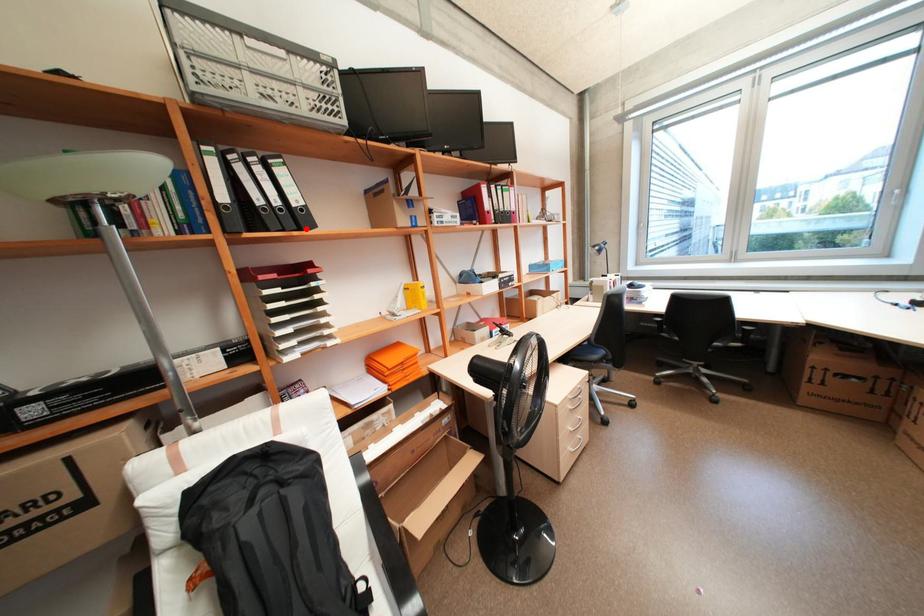
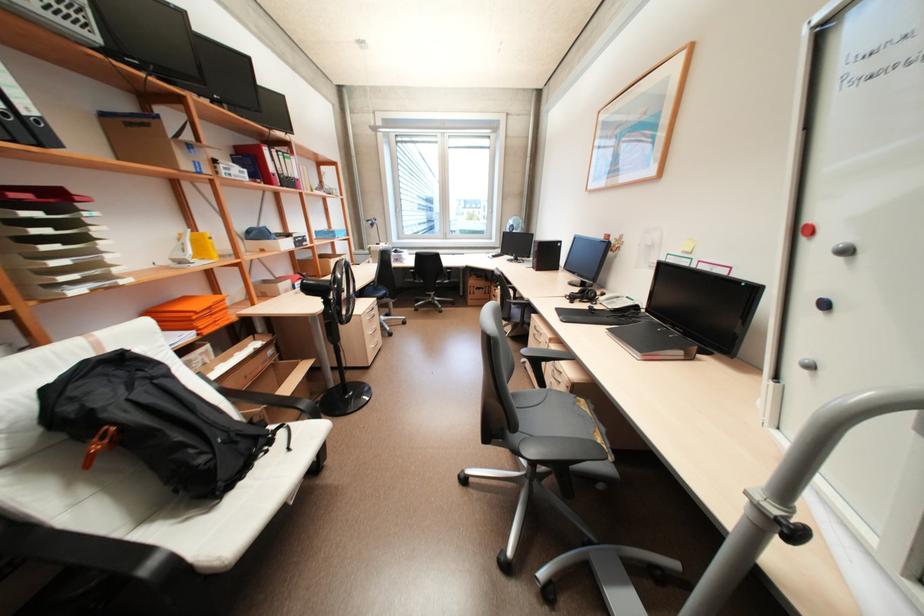
Find the pixel in the second image that matches the highlighted location in the first image.

(46, 146)